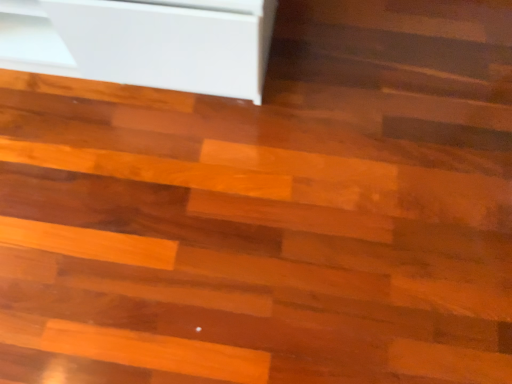
Locate an element on the screen. vacant area that lies in front of white glossy baseboard at upper left is located at coordinates (140, 209).